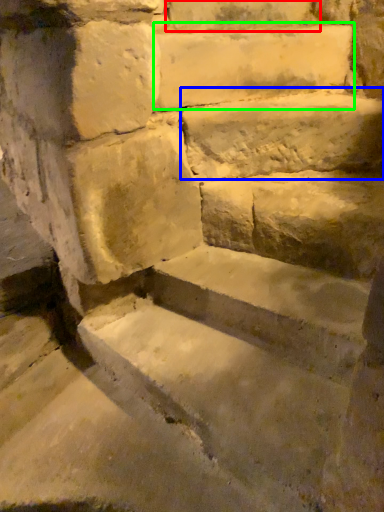
Question: Which is nearer to the brick (highlighted by a red box)? limestone (highlighted by a blue box) or limestone (highlighted by a green box).

Choices:
 (A) limestone
 (B) limestone

Answer: (B)